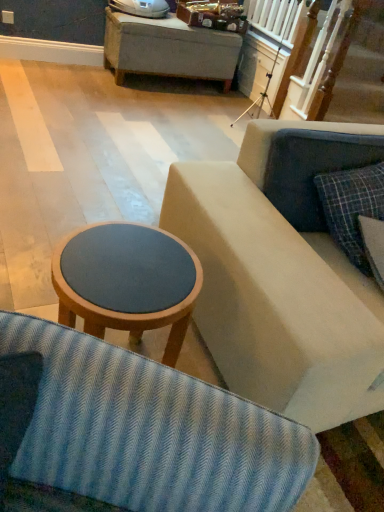
Question: Is there a large distance between plaid fabric pillow at right and matte wood stool at center?

Choices:
 (A) no
 (B) yes

Answer: (A)

Question: Is the depth of plaid fabric pillow at right less than that of matte wood stool at center?

Choices:
 (A) no
 (B) yes

Answer: (A)

Question: From a real-world perspective, is plaid fabric pillow at right below matte wood stool at center?

Choices:
 (A) no
 (B) yes

Answer: (A)

Question: Could you tell me if plaid fabric pillow at right is turned towards matte wood stool at center?

Choices:
 (A) no
 (B) yes

Answer: (A)

Question: Is plaid fabric pillow at right to the left of matte wood stool at center from the viewer's perspective?

Choices:
 (A) no
 (B) yes

Answer: (A)

Question: From a real-world perspective, does plaid fabric pillow at right stand above matte wood stool at center?

Choices:
 (A) yes
 (B) no

Answer: (A)

Question: Can you confirm if matte wood stool at center is smaller than plaid fabric pillow at right?

Choices:
 (A) no
 (B) yes

Answer: (A)

Question: Is matte wood stool at center wider than plaid fabric pillow at right?

Choices:
 (A) yes
 (B) no

Answer: (A)

Question: Does matte wood stool at center appear on the left side of plaid fabric pillow at right?

Choices:
 (A) yes
 (B) no

Answer: (A)

Question: Can you confirm if matte wood stool at center is taller than plaid fabric pillow at right?

Choices:
 (A) no
 (B) yes

Answer: (B)

Question: Considering the relative sizes of matte wood stool at center and plaid fabric pillow at right in the image provided, is matte wood stool at center bigger than plaid fabric pillow at right?

Choices:
 (A) no
 (B) yes

Answer: (B)

Question: Can you confirm if matte wood stool at center is shorter than plaid fabric pillow at right?

Choices:
 (A) yes
 (B) no

Answer: (B)

Question: From a real-world perspective, is matte wood stool at center positioned above or below plaid fabric pillow at right?

Choices:
 (A) above
 (B) below

Answer: (B)